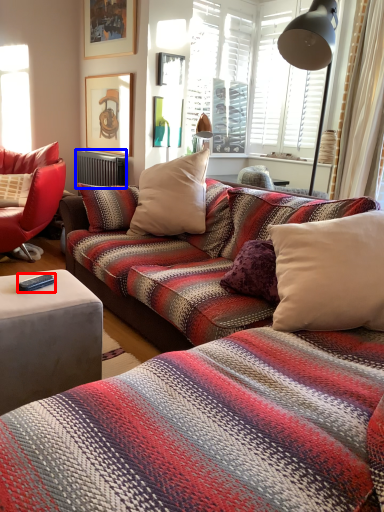
Question: Which of the following is the farthest to the observer, remote control (highlighted by a red box) or radiator (highlighted by a blue box)?

Choices:
 (A) remote control
 (B) radiator

Answer: (B)